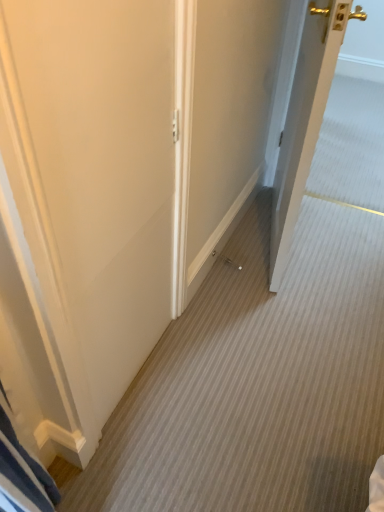
Question: From the image's perspective, is white wood door at right, placed as the 2th door when sorted from left to right, above or below white matte door at center, marked as the second door in a right-to-left arrangement?

Choices:
 (A) below
 (B) above

Answer: (B)

Question: Do you think white wood door at right, placed as the 2th door when sorted from left to right, is within white matte door at center, the 1th door when ordered from left to right, or outside of it?

Choices:
 (A) outside
 (B) inside

Answer: (A)

Question: Considering their positions, is white wood door at right, placed as the 2th door when sorted from left to right, located in front of or behind white matte door at center, the 1th door when ordered from left to right?

Choices:
 (A) behind
 (B) front

Answer: (A)

Question: Would you say white matte door at center, the 1th door when ordered from left to right, is inside or outside white wood door at right, placed as the 2th door when sorted from left to right?

Choices:
 (A) outside
 (B) inside

Answer: (A)

Question: Considering the positions of white matte door at center, marked as the second door in a right-to-left arrangement, and white wood door at right, the first door positioned from the right, in the image, is white matte door at center, marked as the second door in a right-to-left arrangement, bigger or smaller than white wood door at right, the first door positioned from the right,?

Choices:
 (A) big
 (B) small

Answer: (B)

Question: Relative to white wood door at right, placed as the 2th door when sorted from left to right, is white matte door at center, marked as the second door in a right-to-left arrangement, in front or behind?

Choices:
 (A) behind
 (B) front

Answer: (B)

Question: Considering the positions of point (44, 17) and point (284, 144), is point (44, 17) closer or farther from the camera than point (284, 144)?

Choices:
 (A) closer
 (B) farther

Answer: (A)